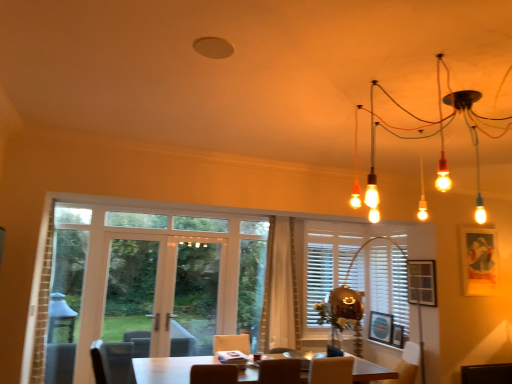
Question: Does white glossy table at center have a smaller size compared to white sheer curtain at center?

Choices:
 (A) no
 (B) yes

Answer: (A)

Question: Is white glossy table at center at the right side of white sheer curtain at center?

Choices:
 (A) no
 (B) yes

Answer: (A)

Question: Considering the relative sizes of white glossy table at center and white sheer curtain at center in the image provided, is white glossy table at center thinner than white sheer curtain at center?

Choices:
 (A) yes
 (B) no

Answer: (B)

Question: Is white glossy table at center completely or partially outside of white sheer curtain at center?

Choices:
 (A) yes
 (B) no

Answer: (A)

Question: Would you say white glossy table at center contains white sheer curtain at center?

Choices:
 (A) no
 (B) yes

Answer: (A)

Question: From the image's perspective, is white sheer curtain at center above or below wooden picture frame at center, the 1th picture frame viewed from the left?

Choices:
 (A) below
 (B) above

Answer: (B)

Question: Considering the positions of white sheer curtain at center and wooden picture frame at center, the 1th picture frame viewed from the left, in the image, is white sheer curtain at center bigger or smaller than wooden picture frame at center, the 1th picture frame viewed from the left,?

Choices:
 (A) big
 (B) small

Answer: (A)

Question: From a real-world perspective, is white sheer curtain at center above or below wooden picture frame at center, the 1th picture frame viewed from the left?

Choices:
 (A) above
 (B) below

Answer: (A)

Question: Based on their positions, is white sheer curtain at center located to the left or right of wooden picture frame at center, the fourth picture frame from the right?

Choices:
 (A) left
 (B) right

Answer: (A)

Question: From a real-world perspective, is white glossy table at center physically located above or below white sheer curtain at center?

Choices:
 (A) below
 (B) above

Answer: (A)

Question: Does point (150, 360) appear closer or farther from the camera than point (287, 294)?

Choices:
 (A) closer
 (B) farther

Answer: (A)

Question: Is white glossy table at center in front of or behind white sheer curtain at center in the image?

Choices:
 (A) front
 (B) behind

Answer: (A)

Question: Visually, is white glossy table at center positioned to the left or to the right of white sheer curtain at center?

Choices:
 (A) right
 (B) left

Answer: (B)

Question: From a real-world perspective, is wooden picture frame at right, acting as the second picture frame starting from the right, above or below wooden picture frame at center, the fourth picture frame from the right?

Choices:
 (A) below
 (B) above

Answer: (B)

Question: In the image, is wooden picture frame at right, acting as the second picture frame starting from the right, positioned in front of or behind wooden picture frame at center, the 1th picture frame viewed from the left?

Choices:
 (A) behind
 (B) front

Answer: (B)